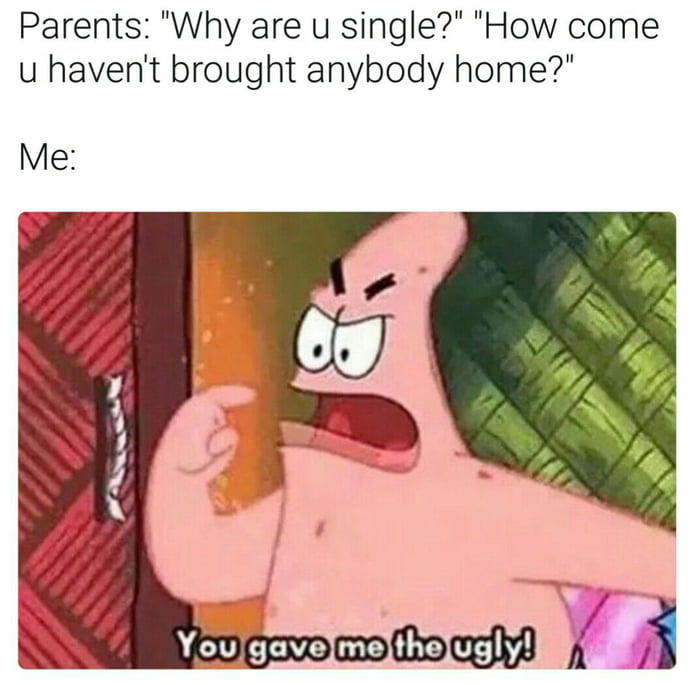
Locate an element on the screen. Image resolution: width=700 pixels, height=685 pixels. handle is located at coordinates (115, 451).